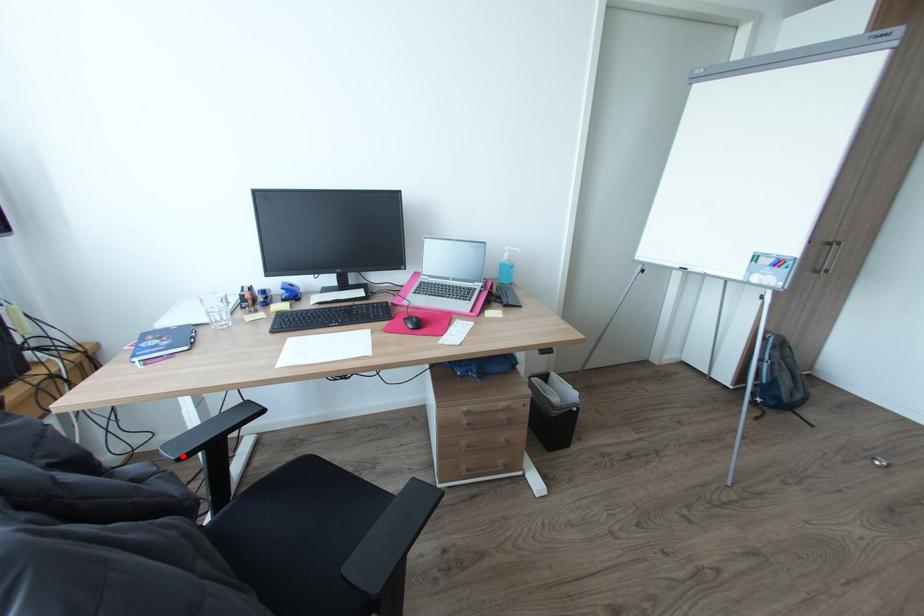
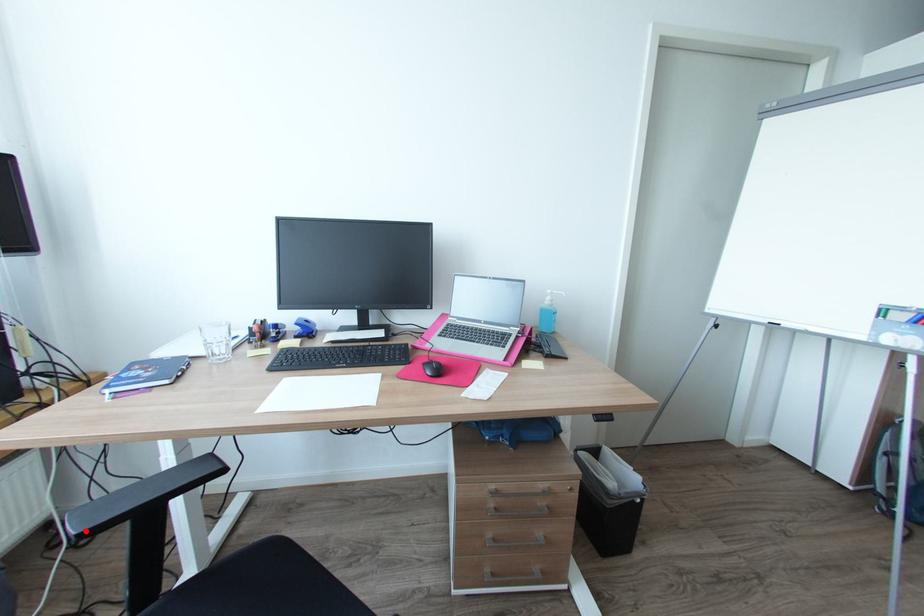
I am providing you with two images of the same scene from different viewpoints. A red point is marked on the first image and another point is marked on the second image. Is the red point in image1 aligned with the point shown in image2?

Yes